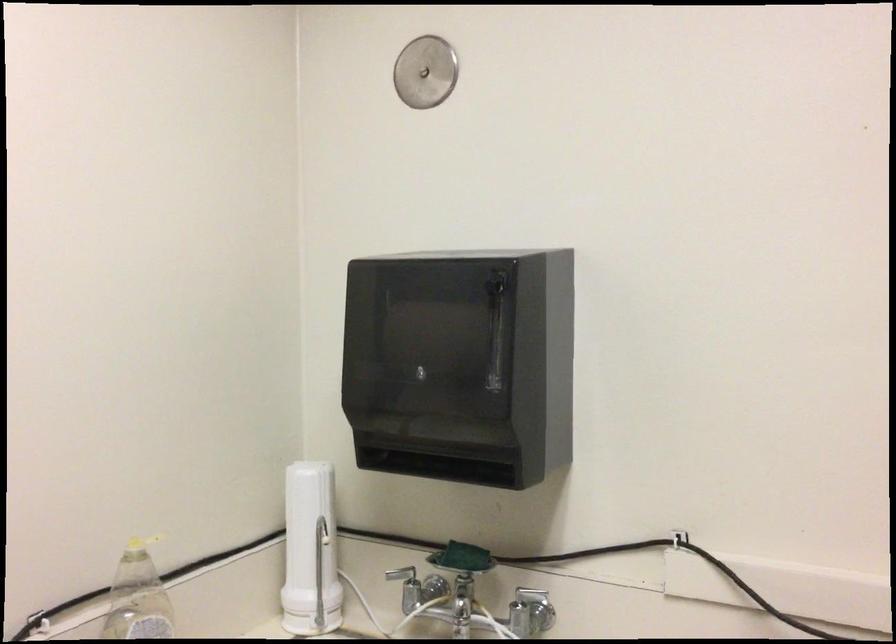
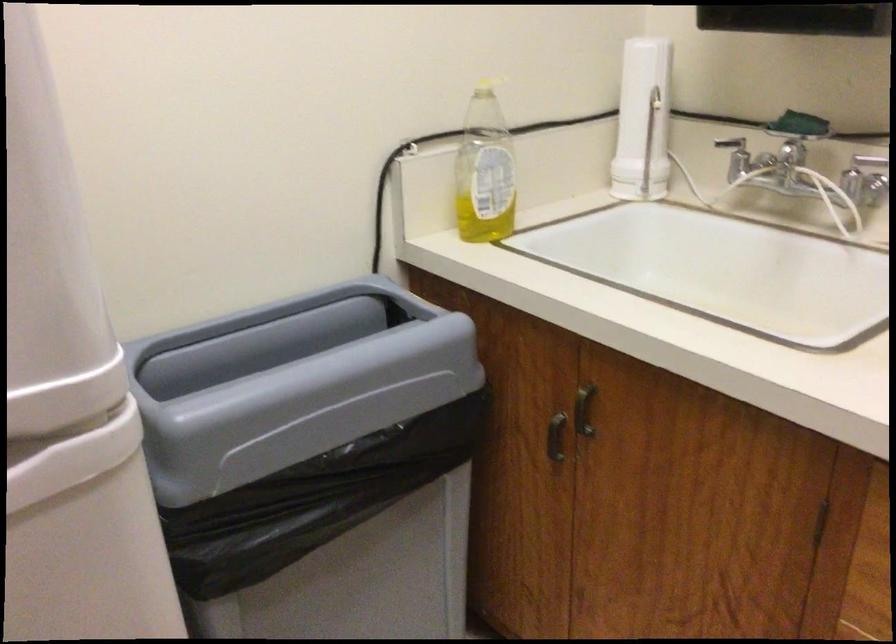
How did the camera likely rotate?

The camera rotated toward left-down.